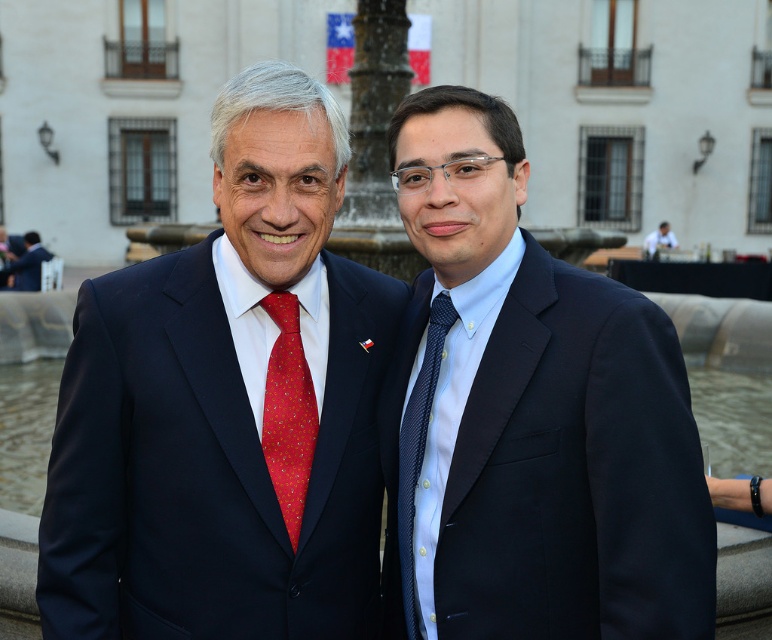
Question: In this image, where is dark blue textured tie at center located relative to white glossy shirt at upper center?

Choices:
 (A) left
 (B) right

Answer: (A)

Question: Which object is positioned closest to the matte black suit at left?

Choices:
 (A) white glossy shirt at upper center
 (B) red silk tie at center

Answer: (A)

Question: Which is farther from the blue satin suit at center?

Choices:
 (A) white glossy shirt at upper center
 (B) red silk tie at center

Answer: (A)

Question: Can you confirm if blue satin suit at center is positioned above white glossy shirt at upper center?

Choices:
 (A) yes
 (B) no

Answer: (B)

Question: Where is navy blue suit at center located in relation to white glossy shirt at upper center in the image?

Choices:
 (A) right
 (B) left

Answer: (B)

Question: Estimate the real-world distances between objects in this image. Which object is farther from the navy blue suit at center?

Choices:
 (A) matte black suit at left
 (B) white glossy shirt at upper center

Answer: (B)